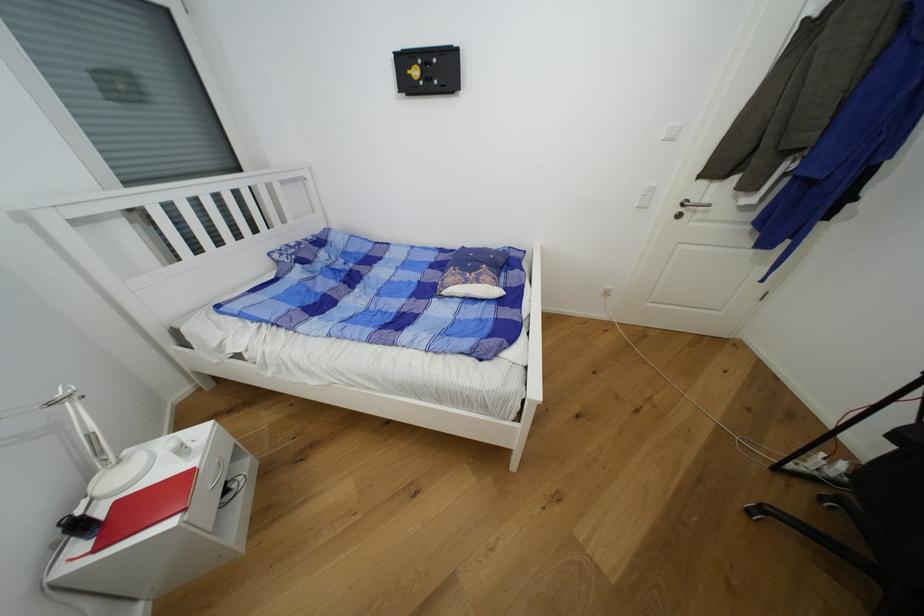
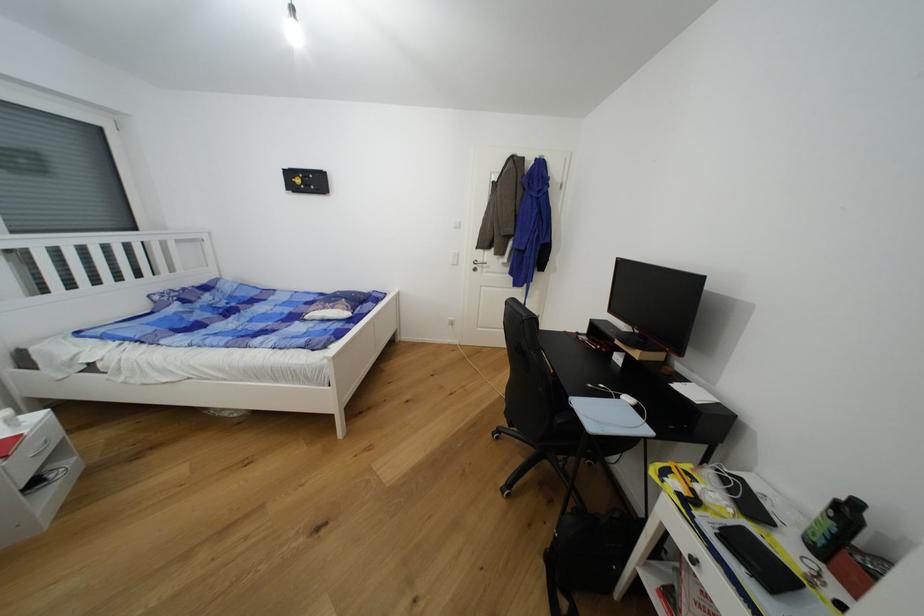
Question: I am providing you with two images of the same scene from different viewpoints. After the viewpoint changes to image2, which objects are now occluded?

Choices:
 (A) silver door handle
 (B) black smartphone
 (C) black plastic bottle
 (D) none of these

Answer: (D)